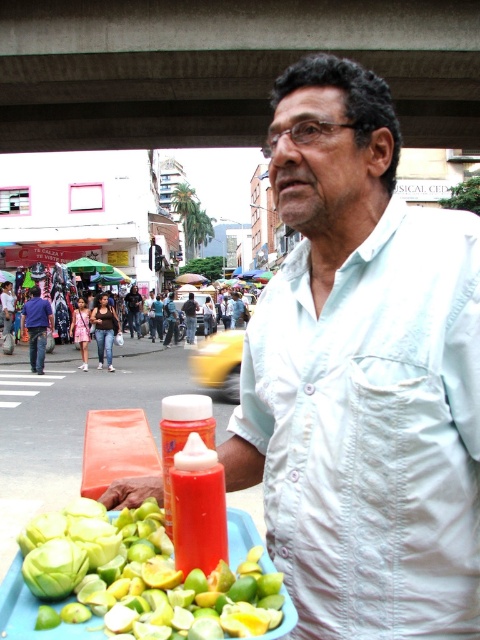
Is white cotton shirt at center wider than purple cotton shirt at left?

Yes, white cotton shirt at center is wider than purple cotton shirt at left.

Does white cotton shirt at center have a smaller size compared to purple cotton shirt at left?

Incorrect, white cotton shirt at center is not smaller in size than purple cotton shirt at left.

This screenshot has width=480, height=640. I want to click on white cotton shirt at center, so point(362,376).

Between point (29, 324) and point (136, 314), which one is positioned behind?

The point (136, 314) is more distant.

Is point (33, 333) less distant than point (126, 296)?

That is True.

Is point (51, 314) positioned before point (131, 320)?

Yes, point (51, 314) is closer to viewer.

This screenshot has width=480, height=640. Find the location of `purple cotton shirt at left`. purple cotton shirt at left is located at coordinates (36, 326).

Which is more to the left, green matte cabbage at lower left or matte white shirt at center?

From the viewer's perspective, matte white shirt at center appears more on the left side.

Between green matte cabbage at lower left and matte white shirt at center, which one is positioned lower?

green matte cabbage at lower left is below.

Is point (70, 580) closer to camera compared to point (190, 317)?

Yes, it is in front of point (190, 317).

Locate an element on the screen. green matte cabbage at lower left is located at coordinates (55, 568).